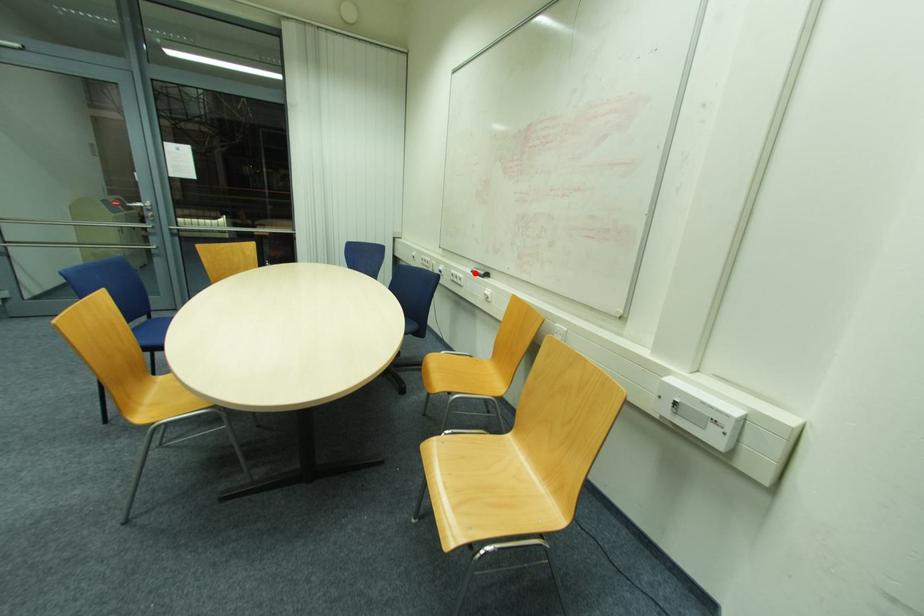
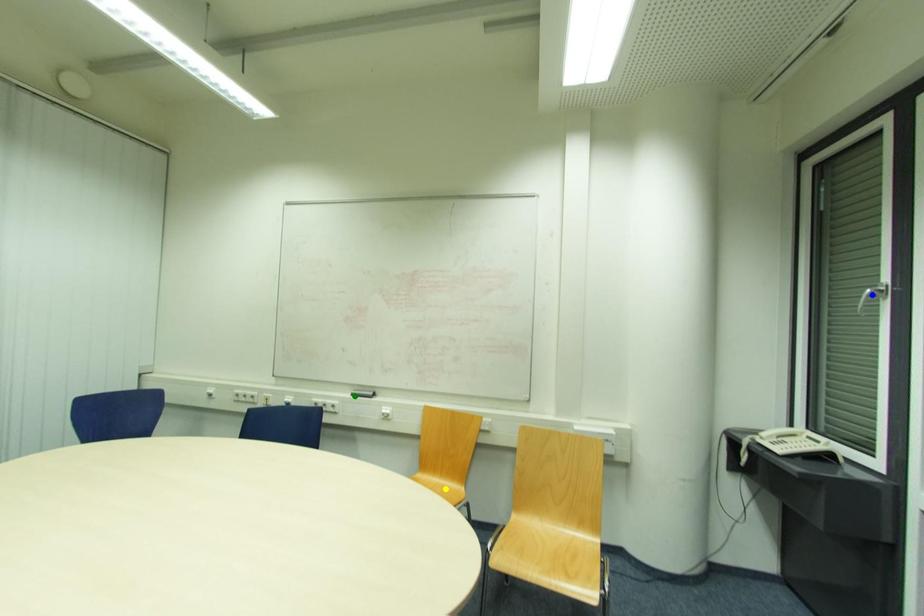
Question: I am providing you with two images of the same scene from different viewpoints. A red point is marked on the first image. You are given multiple points on the second image. Which spot in image 2 lines up with the point in image 1?

Choices:
 (A) green point
 (B) blue point
 (C) yellow point

Answer: (A)